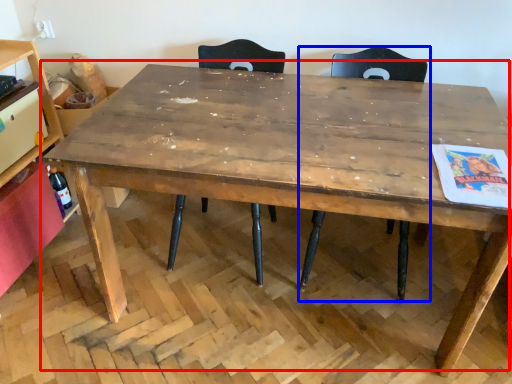
Question: Which of the following is the closest to the observer, table (highlighted by a red box) or chair (highlighted by a blue box)?

Choices:
 (A) table
 (B) chair

Answer: (A)